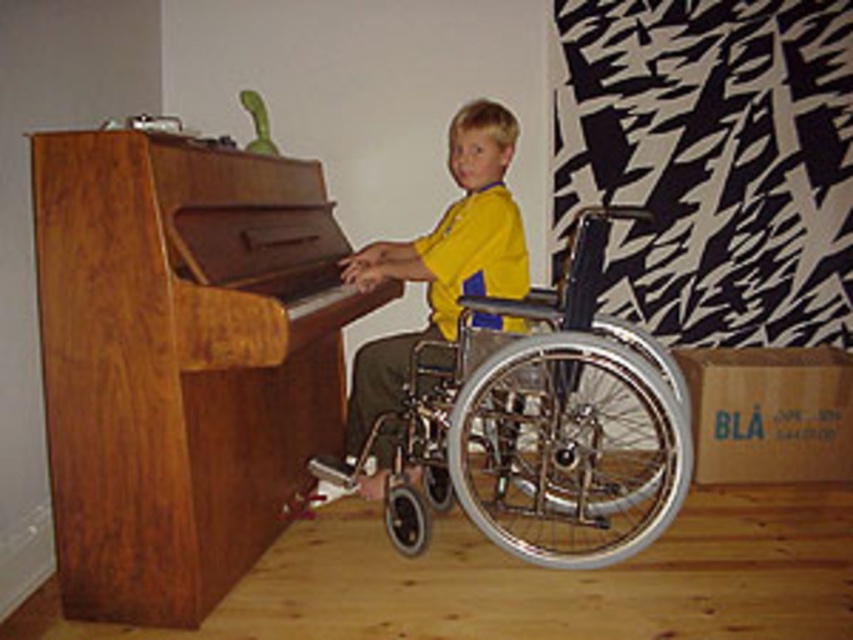
You are taking a photo of the scene and want to focus on both the point at coordinates point (352, 316) and point (482, 220). Which point should you focus on first to ensure both are in focus?

You should focus on point (352, 316) first because it is closer to the camera than point (482, 220), ensuring both points will be in focus when focusing on the closer one.

The wooden piano at left and the silver metallic wheelchair at center are both in the room. Which object is taller?

The wooden piano at left is taller than the silver metallic wheelchair at center.

Based on the photo, you are a physical therapist observing the scene. You need to determine if there is enough space between the silver metallic wheelchair at center and the metallic silver wheelchair at center for a 1.2 meter wide therapy mat. Is there sufficient space?

The silver metallic wheelchair at center is bigger than the metallic silver wheelchair at center, but since both are the same object, there is no space between them. Therefore, the therapy mat cannot be placed between them.